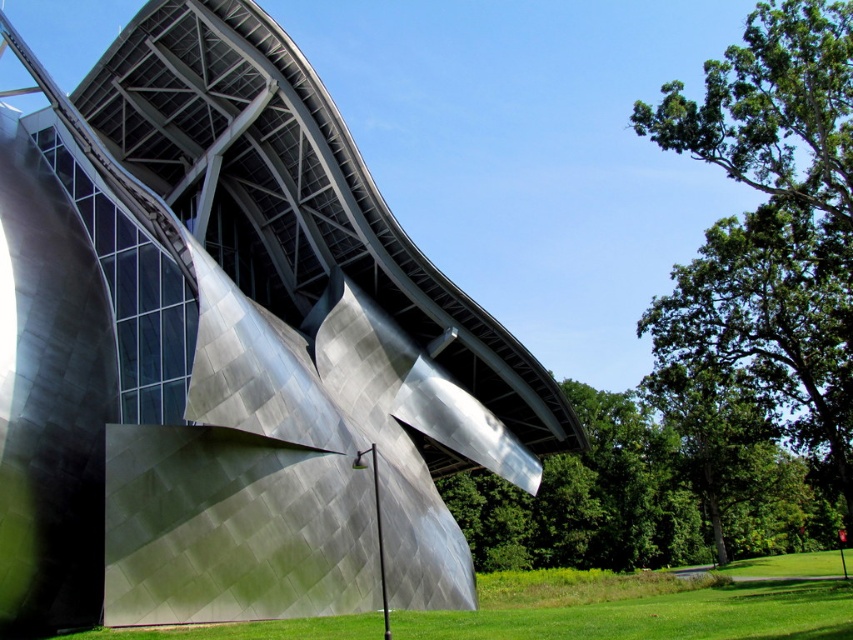
You are a drone operator planning to capture aerial footage of the metallic silver building at center and the green grass at lower center. Based on their sizes, which one would require a closer flyby to ensure detailed capture?

The metallic silver building at center has a smaller size compared to green grass at lower center, so to capture details, the drone needs to fly closer to the metallic silver building at center.

You are a landscape architect planning to install a new garden bed that requires 10 meters of space. You observe the metallic silver building at center and the green grass at lower center in the scene. Which area would be suitable for the garden bed based on their widths?

The green grass at lower center has a greater width than the metallic silver building at center, so the garden bed requiring 10 meters of space would be suitable for the green grass at lower center.

You are standing on the green grass at lower center looking up. Which direction should you look to see the metallic silver building at center?

Result: The metallic silver building at center is located above green grass at lower center, so you should look upward to see it.